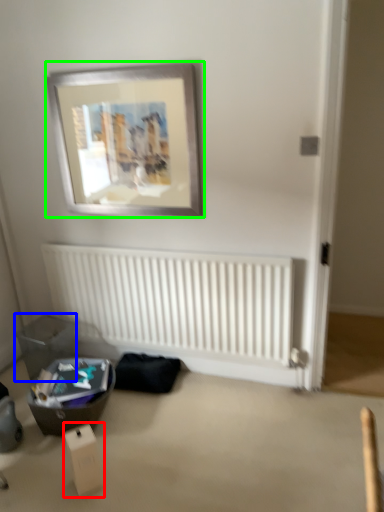
Question: Which object is positioned closest to cardboard box (highlighted by a red box)? Select from storage box (highlighted by a blue box) and picture frame (highlighted by a green box).

Choices:
 (A) storage box
 (B) picture frame

Answer: (A)